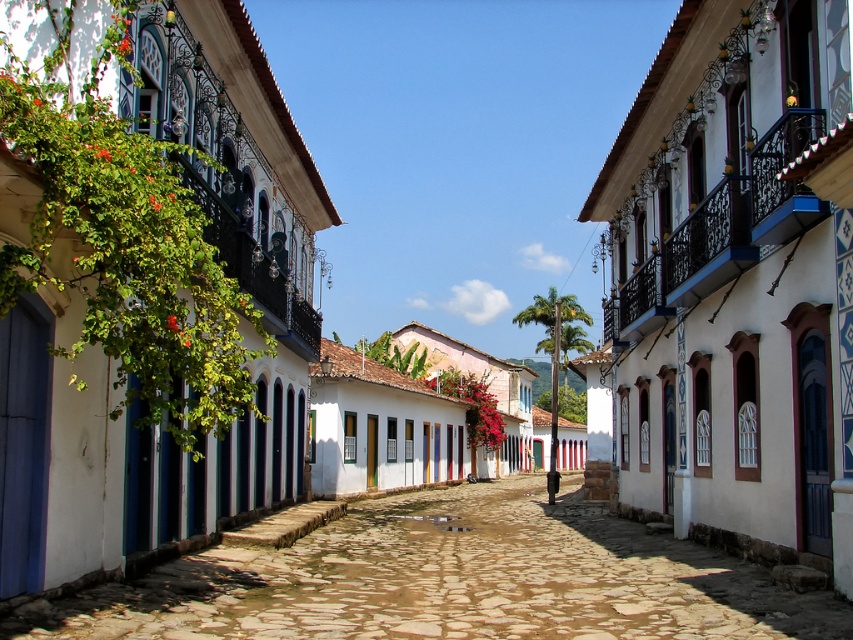
You are a painter hired to paint two white painted walls in a colonial town. The walls are the white painted wall at center and the white painted wall at left. Which wall requires less paint because of its size?

The white painted wall at center requires less paint because it is smaller than the white painted wall at left.

You are a painter who needs to know which white painted wall is narrower between the white painted wall at center and the white painted wall at left. Which one is narrower?

The white painted wall at center has a lesser width compared to the white painted wall at left, so the white painted wall at center is narrower.

You are standing on the cobblestone street in front of the white painted wall at center. If you walk straight ahead, will you eventually reach the end of the wall?

The white painted wall at center is located at point (737, 280). Since the wall is at the center of the scene, walking straight ahead might lead you towards the middle of the street, but the description does not specify the wall extends to the end of the street. Therefore, it is uncertain if you will reach the end of the wall by walking straight ahead.